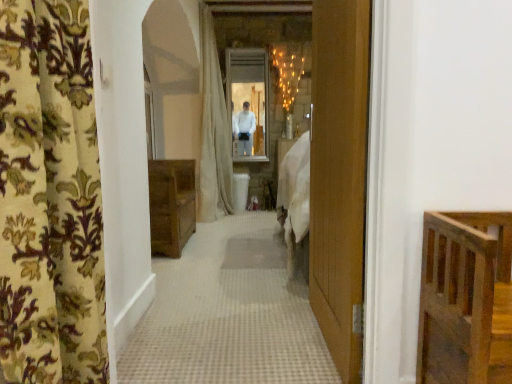
Question: Does beige fabric shower curtain at center have a smaller size compared to white glossy mirror at center?

Choices:
 (A) no
 (B) yes

Answer: (A)

Question: Can you confirm if beige fabric shower curtain at center is positioned to the left of white glossy mirror at center?

Choices:
 (A) no
 (B) yes

Answer: (B)

Question: Is beige fabric shower curtain at center positioned with its back to white glossy mirror at center?

Choices:
 (A) no
 (B) yes

Answer: (A)

Question: Does beige fabric shower curtain at center turn towards white glossy mirror at center?

Choices:
 (A) no
 (B) yes

Answer: (B)

Question: Is white glossy mirror at center located within beige fabric shower curtain at center?

Choices:
 (A) yes
 (B) no

Answer: (A)

Question: Considering the relative positions of beige fabric shower curtain at center and white glossy mirror at center in the image provided, is beige fabric shower curtain at center in front of white glossy mirror at center?

Choices:
 (A) yes
 (B) no

Answer: (A)

Question: Considering the relative sizes of white glossy mirror at center and floral-patterned fabric at left in the image provided, is white glossy mirror at center wider than floral-patterned fabric at left?

Choices:
 (A) yes
 (B) no

Answer: (B)

Question: Considering the relative sizes of white glossy mirror at center and floral-patterned fabric at left in the image provided, is white glossy mirror at center bigger than floral-patterned fabric at left?

Choices:
 (A) no
 (B) yes

Answer: (A)

Question: From a real-world perspective, is white glossy mirror at center below floral-patterned fabric at left?

Choices:
 (A) yes
 (B) no

Answer: (B)

Question: Is white glossy mirror at center positioned in front of floral-patterned fabric at left?

Choices:
 (A) yes
 (B) no

Answer: (B)

Question: Is white glossy mirror at center at the right side of floral-patterned fabric at left?

Choices:
 (A) yes
 (B) no

Answer: (A)

Question: Considering the relative positions of white glossy mirror at center and floral-patterned fabric at left in the image provided, is white glossy mirror at center behind floral-patterned fabric at left?

Choices:
 (A) no
 (B) yes

Answer: (B)

Question: Would you say floral-patterned fabric at left is part of beige fabric shower curtain at center's contents?

Choices:
 (A) yes
 (B) no

Answer: (B)